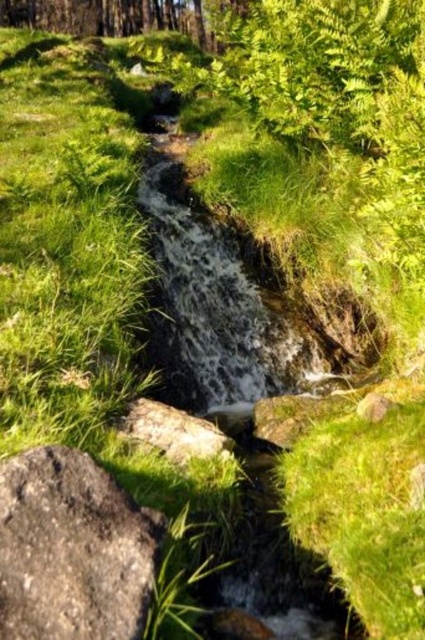
Can you confirm if gray rough rock at lower left is positioned to the right of gray rough rock at center?

Incorrect, gray rough rock at lower left is not on the right side of gray rough rock at center.

Is gray rough rock at lower left below gray rough rock at center?

Correct, gray rough rock at lower left is located below gray rough rock at center.

Which is in front, point (28, 561) or point (190, 419)?

Point (28, 561)

Image resolution: width=425 pixels, height=640 pixels. What are the coordinates of `gray rough rock at lower left` in the screenshot? It's located at click(x=71, y=548).